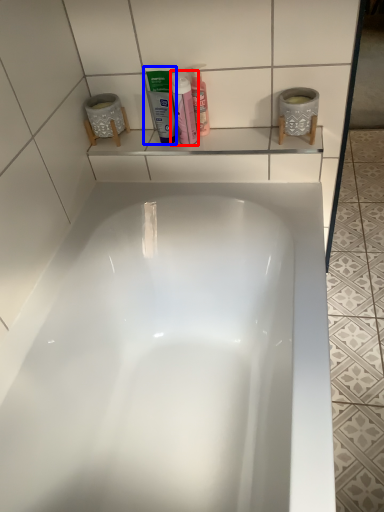
Question: Which object appears closest to the camera in this image, cleaning product (highlighted by a red box) or mouthwash (highlighted by a blue box)?

Choices:
 (A) cleaning product
 (B) mouthwash

Answer: (A)